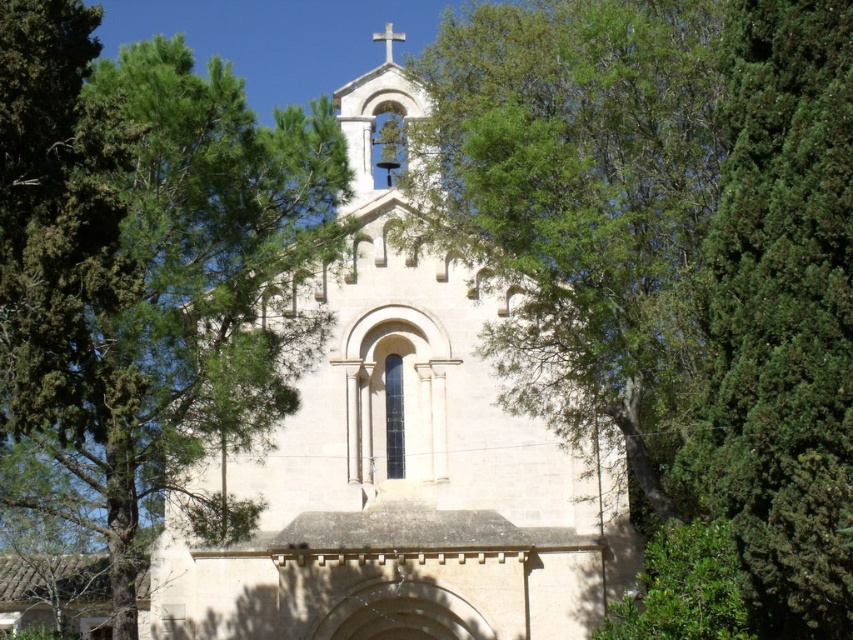
Question: From the image, what is the correct spatial relationship of green leafy tree at center in relation to green leafy tree at upper left?

Choices:
 (A) right
 (B) left

Answer: (A)

Question: Which object is positioned farthest from the green leafy tree at upper left?

Choices:
 (A) green leafy tree at center
 (B) white stone church at center

Answer: (A)

Question: Can you confirm if green leafy tree at center is bigger than green leafy tree at upper left?

Choices:
 (A) no
 (B) yes

Answer: (B)

Question: Which point is farther to the camera?

Choices:
 (A) green leafy tree at upper left
 (B) white stone church at center

Answer: (B)

Question: Is green leafy tree at center positioned at the back of white stone church at center?

Choices:
 (A) yes
 (B) no

Answer: (B)

Question: Which object is farther from the camera taking this photo?

Choices:
 (A) white stone church at center
 (B) green leafy tree at upper left
 (C) green leafy tree at center

Answer: (A)